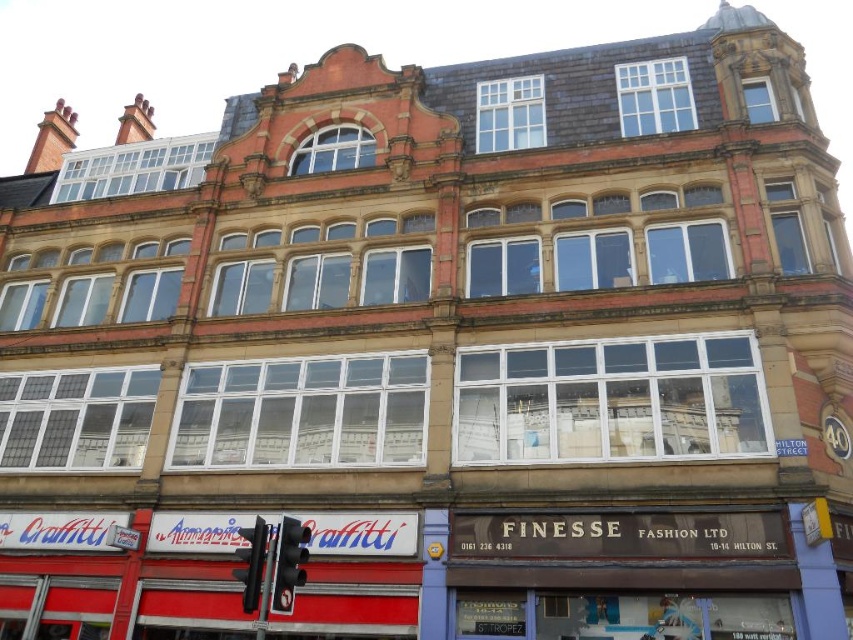
Can you confirm if black plastic traffic light at lower left is positioned below black plastic traffic light at center?

No.

Between black plastic traffic light at lower left and black plastic traffic light at center, which one is positioned lower?

black plastic traffic light at center

Which is behind, point (306, 554) or point (244, 611)?

Positioned behind is point (306, 554).

You are a GUI agent. You are given a task and a screenshot of the screen. Output one action in this format:
    pyautogui.click(x=<x>, y=<y>)
    Task: Click on the black plastic traffic light at lower left
    This screenshot has height=640, width=853.
    Given the screenshot: What is the action you would take?
    pyautogui.click(x=289, y=563)